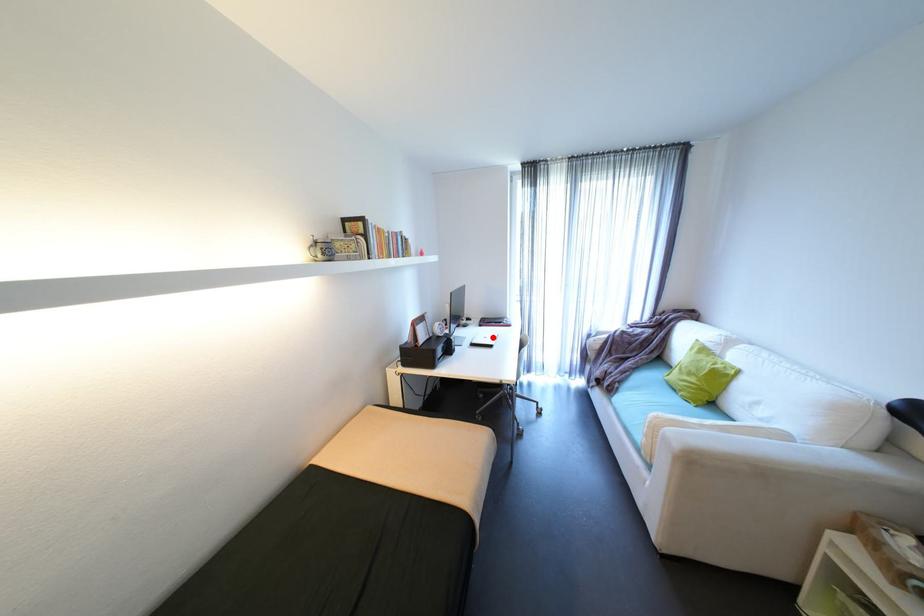
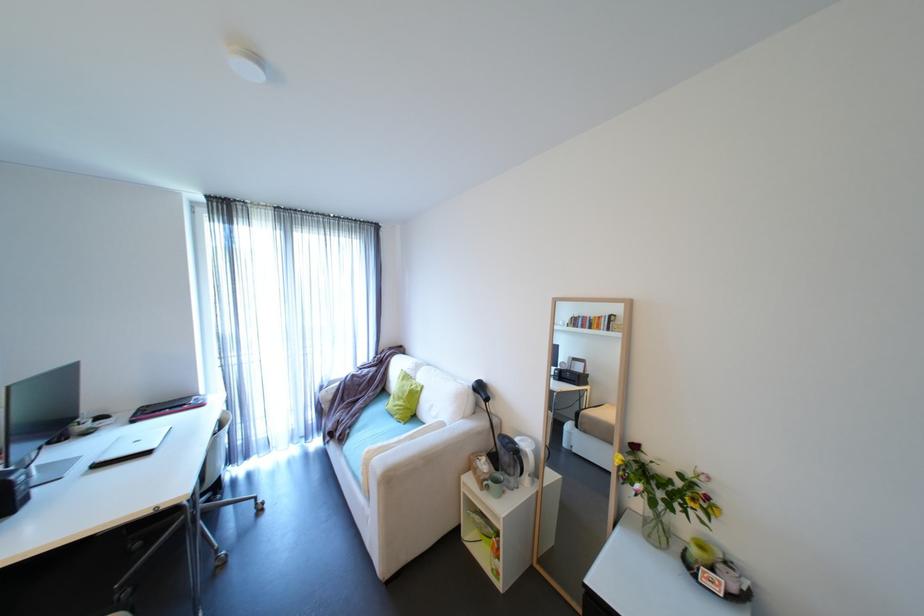
Find the pixel in the second image that matches the highlighted location in the first image.

(144, 440)